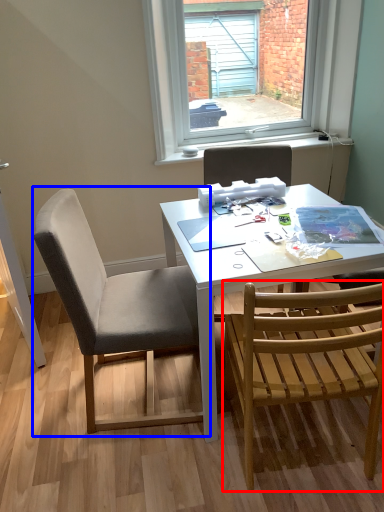
Question: Which object is closer to the camera taking this photo, chair (highlighted by a red box) or chair (highlighted by a blue box)?

Choices:
 (A) chair
 (B) chair

Answer: (A)